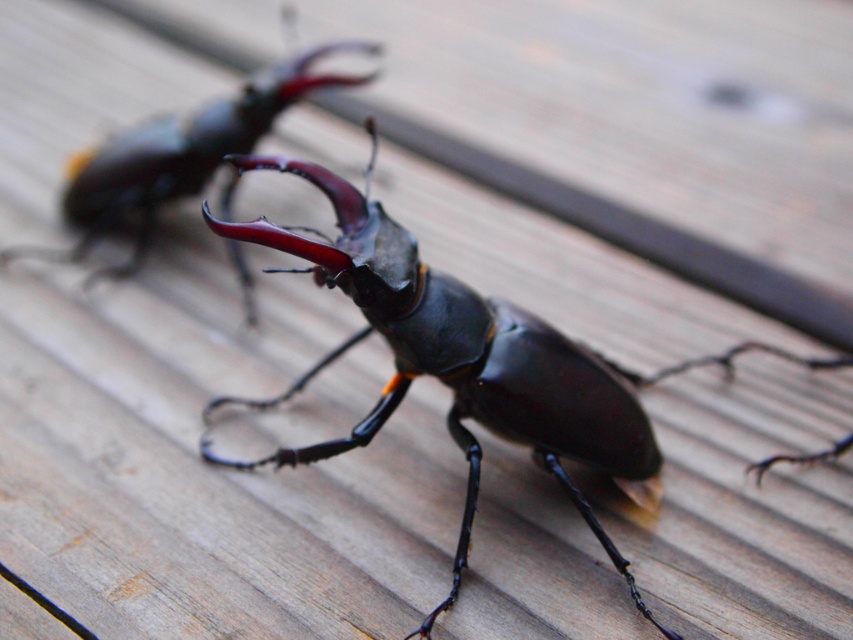
You are a photographer trying to capture both beetles clearly. You notice two points marked on your viewfinder at coordinates point (345, 259) and point (192, 115). Which point is closer to the camera, allowing for better focus?

Point (345, 259) is in front of point (192, 115), so it is closer to the camera and will be in better focus.

You are a researcher examining a wooden surface with two stag beetles. You notice a point at coordinates (463, 360). Which beetle is located at this point?

The shiny black beetle at center is located at point (463, 360).